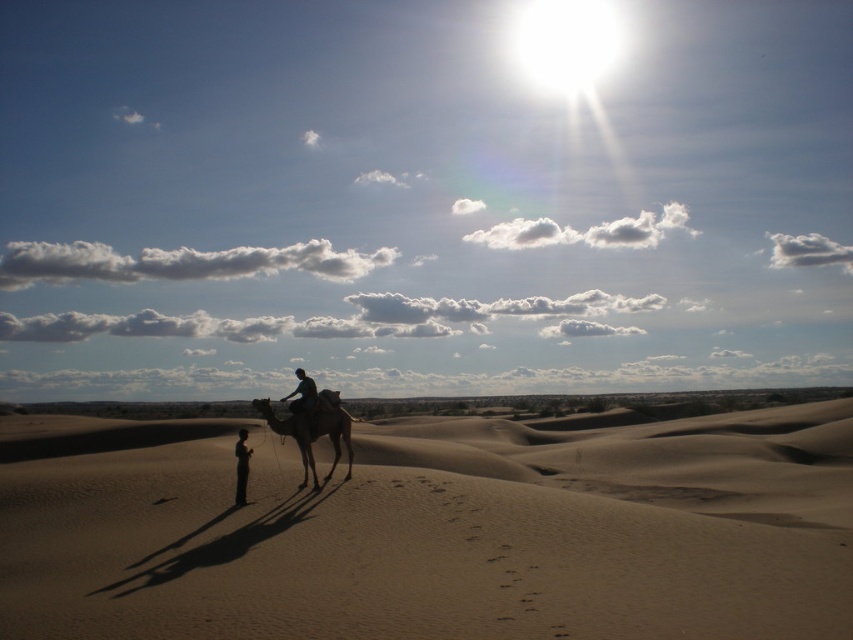
Question: Does smooth sand dune at center come in front of brown textured camel at center?

Choices:
 (A) yes
 (B) no

Answer: (A)

Question: Which object appears closest to the camera in this image?

Choices:
 (A) silhouette human at center
 (B) smooth beige camel at center
 (C) smooth sand dune at center

Answer: (C)

Question: Which of the following is the farthest from the observer?

Choices:
 (A) silhouette human at center
 (B) smooth beige camel at center
 (C) smooth sand dune at center
 (D) brown textured camel at center

Answer: (A)

Question: Can you confirm if smooth beige camel at center is bigger than silhouette human at center?

Choices:
 (A) yes
 (B) no

Answer: (A)

Question: Which object appears farthest from the camera in this image?

Choices:
 (A) silhouette human at center
 (B) smooth sand dune at center
 (C) brown textured camel at center

Answer: (A)

Question: Does smooth beige camel at center lie in front of silhouette human at center?

Choices:
 (A) no
 (B) yes

Answer: (B)